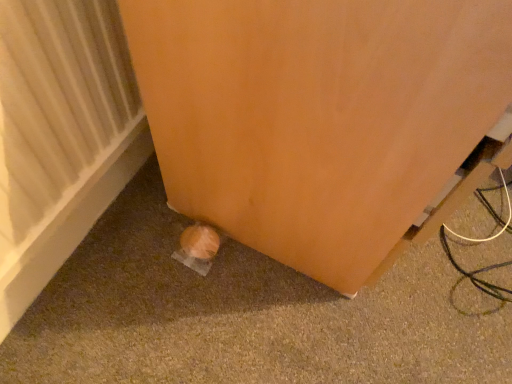
Question: From their relative heights in the image, would you say white textured radiator at lower left is taller or shorter than matte orange door at lower left?

Choices:
 (A) short
 (B) tall

Answer: (A)

Question: From a real-world perspective, is white textured radiator at lower left positioned above or below matte orange door at lower left?

Choices:
 (A) below
 (B) above

Answer: (A)

Question: From the image's perspective, is white textured radiator at lower left above or below matte orange door at lower left?

Choices:
 (A) below
 (B) above

Answer: (A)

Question: From a real-world perspective, is matte orange door at lower left physically located above or below white textured radiator at lower left?

Choices:
 (A) above
 (B) below

Answer: (A)

Question: In the image, is matte orange door at lower left on the left side or the right side of white textured radiator at lower left?

Choices:
 (A) right
 (B) left

Answer: (A)

Question: Based on their sizes in the image, would you say matte orange door at lower left is bigger or smaller than white textured radiator at lower left?

Choices:
 (A) big
 (B) small

Answer: (A)

Question: Does point (465, 150) appear closer or farther from the camera than point (92, 72)?

Choices:
 (A) closer
 (B) farther

Answer: (A)